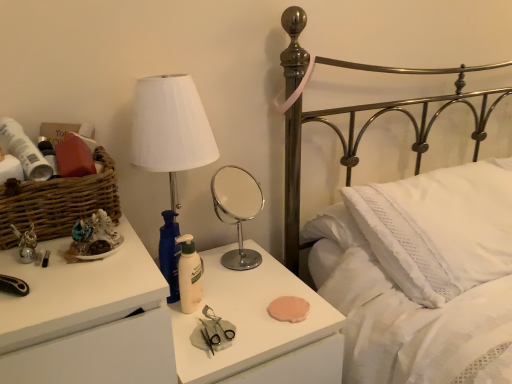
The height and width of the screenshot is (384, 512). Find the location of `vacant space in front of brown woven basket at left`. vacant space in front of brown woven basket at left is located at coordinates (58, 275).